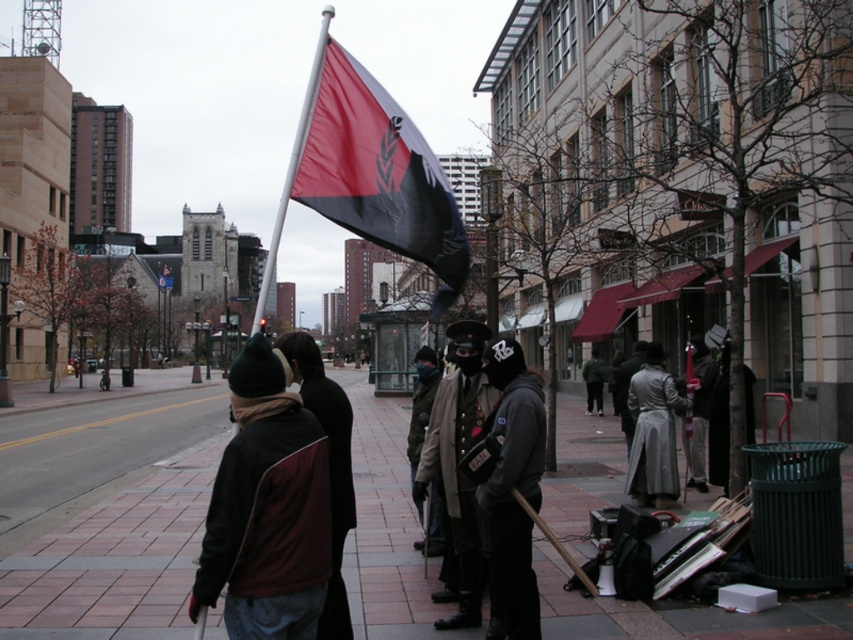
Where is `black fabric beanie at center`? black fabric beanie at center is located at coordinates tap(514, 484).

Can you confirm if black fabric beanie at center is thinner than red and black jacket at center?

Indeed, black fabric beanie at center has a lesser width compared to red and black jacket at center.

Does point (521, 509) come farther from viewer compared to point (317, 362)?

That is False.

Identify the location of black fabric beanie at center. The image size is (853, 640). (514, 484).

From the picture: Who is positioned more to the right, paved brick sidewalk at center or leather jacket at center?

leather jacket at center

Between paved brick sidewalk at center and leather jacket at center, which one appears on the left side from the viewer's perspective?

paved brick sidewalk at center

Where is `paved brick sidewalk at center`? paved brick sidewalk at center is located at coordinates (115, 561).

Consider the image. Is black matte flag at center bigger than silver metallic coat at center?

Yes, black matte flag at center is bigger than silver metallic coat at center.

Who is more distant from viewer, (341, 77) or (630, 381)?

The point (630, 381) is behind.

Is point (358, 97) closer to camera compared to point (637, 403)?

Yes, it is in front of point (637, 403).

Locate an element on the screen. black matte flag at center is located at coordinates (376, 172).